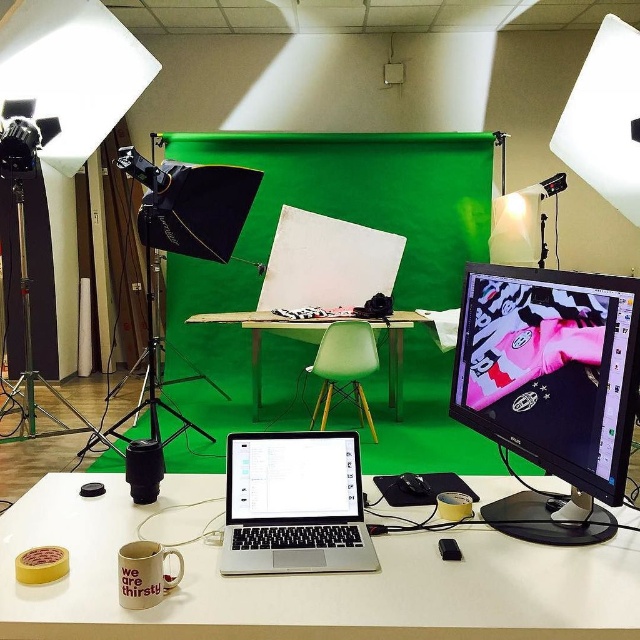
Question: Does white matte table at center appear on the right side of silver metallic laptop at center?

Choices:
 (A) no
 (B) yes

Answer: (B)

Question: Which point is closer to the camera?

Choices:
 (A) matte black monitor at right
 (B) white matte table at center

Answer: (B)

Question: Can you confirm if matte black monitor at right is thinner than green plastic chair at center?

Choices:
 (A) yes
 (B) no

Answer: (A)

Question: Which point is closer to the camera taking this photo?

Choices:
 (A) (500, 528)
 (B) (76, 493)
 (C) (196, 317)
 (D) (326, 522)

Answer: (A)

Question: Which point is farther to the camera?

Choices:
 (A) white glossy laptop at center
 (B) green plastic chair at center
 (C) silver metallic laptop at center
 (D) white matte table at center

Answer: (B)

Question: Where is white matte table at center located in relation to matte beige mug at lower left in the image?

Choices:
 (A) above
 (B) below

Answer: (B)